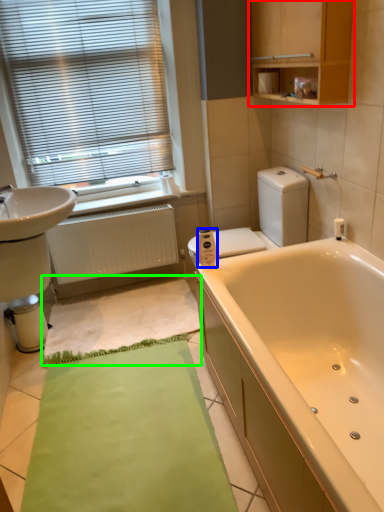
Question: Based on their relative distances, which object is nearer to medicine cabinet (highlighted by a red box)? Choose from toilet paper (highlighted by a blue box) and bath mat (highlighted by a green box).

Choices:
 (A) toilet paper
 (B) bath mat

Answer: (A)